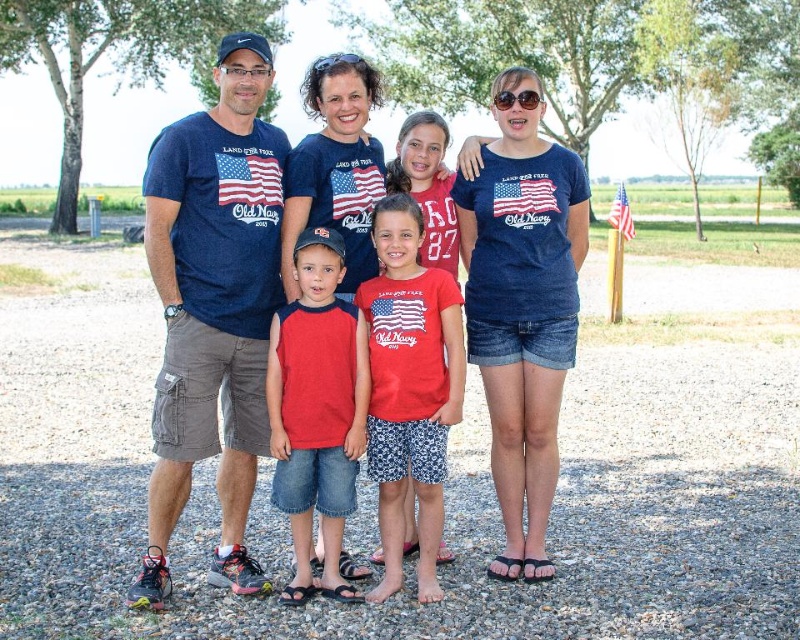
Which is in front, point (254, 84) or point (532, 163)?

Point (254, 84)

You are a GUI agent. You are given a task and a screenshot of the screen. Output one action in this format:
    pyautogui.click(x=<x>, y=<y>)
    Task: Click on the matte blue t-shirt at center
    
    Given the screenshot: What is the action you would take?
    pyautogui.click(x=216, y=308)

Does point (172, 148) come behind point (400, 221)?

Yes, point (172, 148) is behind point (400, 221).

Looking at this image, how distant is matte blue t-shirt at left from red cotton shirt at center?

A distance of 2.10 meters exists between matte blue t-shirt at left and red cotton shirt at center.

Measure the distance between point (233,310) and camera.

Point (233,310) and camera are 7.83 meters apart from each other.

Image resolution: width=800 pixels, height=640 pixels. What are the coordinates of `matte blue t-shirt at left` in the screenshot? It's located at (212, 316).

Looking at this image, who is shorter, matte blue t-shirt at left or american flag fabric at center?

matte blue t-shirt at left

Which is in front, point (168, 509) or point (250, 188)?

Point (168, 509) is in front.

Image resolution: width=800 pixels, height=640 pixels. In order to click on matte blue t-shirt at left in this screenshot , I will do `click(212, 316)`.